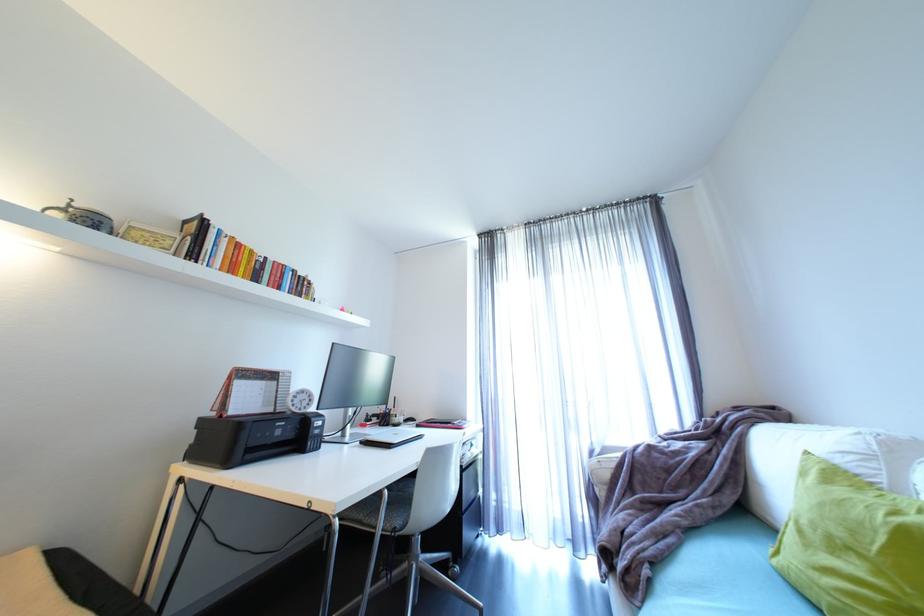
The image size is (924, 616). What do you see at coordinates (252, 438) in the screenshot?
I see `a black printer lid` at bounding box center [252, 438].